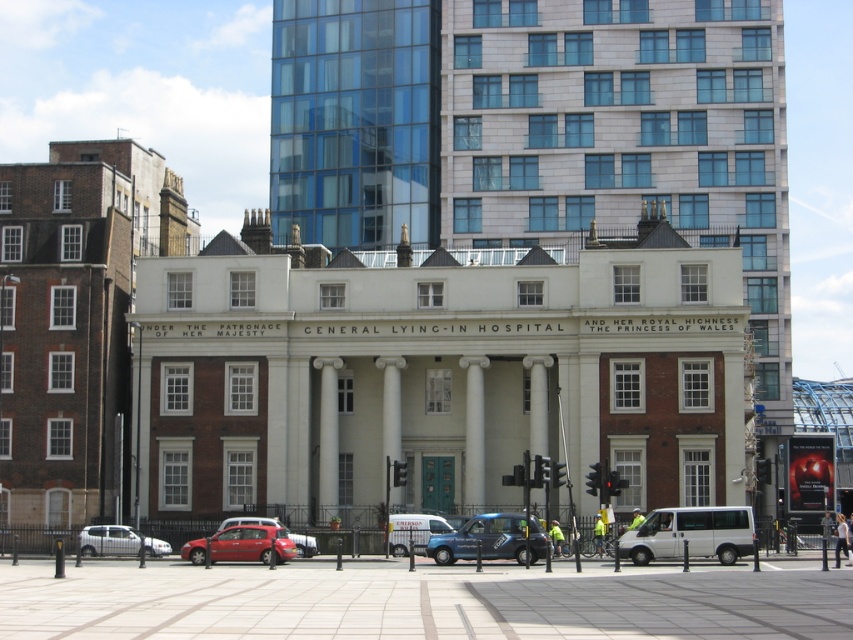
Based on the photo, can you confirm if white stone building at center is shorter than white matte van at center?

Incorrect, white stone building at center's height does not fall short of white matte van at center's.

Is white stone building at center below white matte van at center?

No, white stone building at center is not below white matte van at center.

Between point (554, 429) and point (741, 536), which one is positioned in front?

Point (741, 536) is more forward.

Locate an element on the screen. The image size is (853, 640). white stone building at center is located at coordinates (434, 376).

Based on the photo, is white stone building at center smaller than metallic red car at center?

Incorrect, white stone building at center is not smaller in size than metallic red car at center.

You are a GUI agent. You are given a task and a screenshot of the screen. Output one action in this format:
    pyautogui.click(x=<x>, y=<y>)
    Task: Click on the white stone building at center
    The image size is (853, 640).
    Given the screenshot: What is the action you would take?
    pyautogui.click(x=434, y=376)

This screenshot has width=853, height=640. Find the location of `white stone building at center`. white stone building at center is located at coordinates (434, 376).

At what (x,y) coordinates should I click in order to perform the action: click on white stone building at center. Please return your answer as a coordinate pair (x, y). Image resolution: width=853 pixels, height=640 pixels. Looking at the image, I should click on (434, 376).

Can you confirm if white matte van at center is shorter than metallic red car at center?

Indeed, white matte van at center has a lesser height compared to metallic red car at center.

Based on the photo, can you confirm if white matte van at center is positioned below metallic red car at center?

Actually, white matte van at center is above metallic red car at center.

Is point (665, 536) less distant than point (282, 550)?

Yes.

You are a GUI agent. You are given a task and a screenshot of the screen. Output one action in this format:
    pyautogui.click(x=<x>, y=<y>)
    Task: Click on the white matte van at center
    
    Given the screenshot: What is the action you would take?
    pyautogui.click(x=689, y=532)